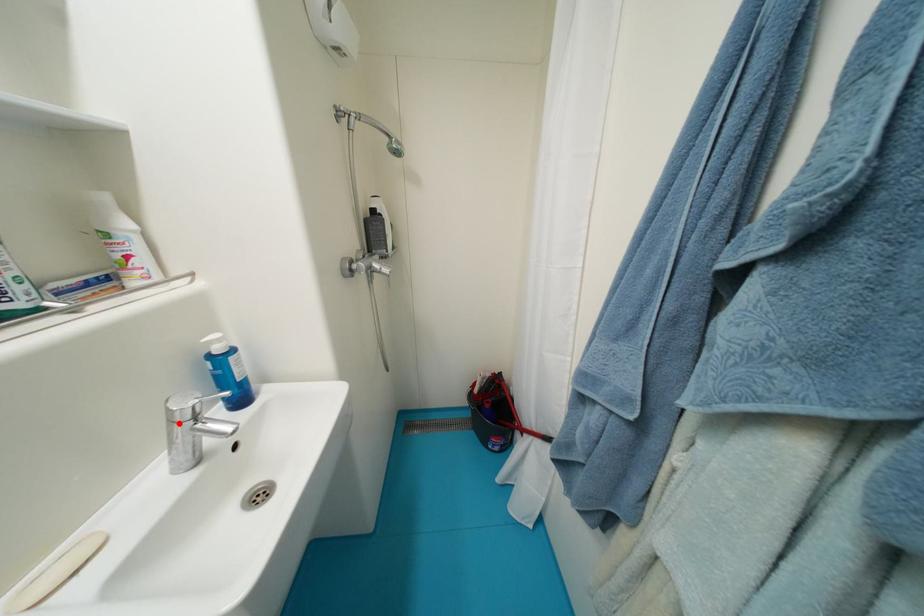
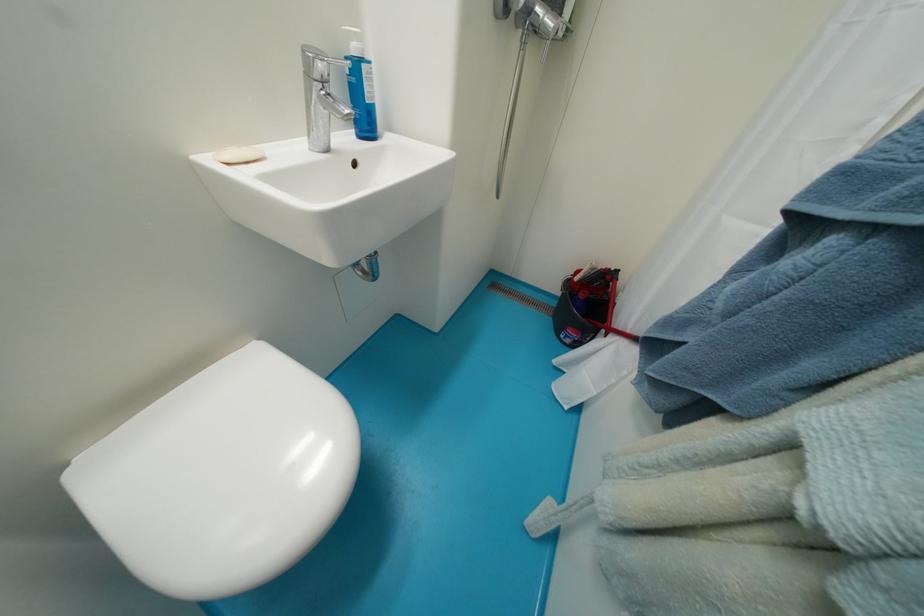
In the second image, find the point that corresponds to the highlighted location in the first image.

(313, 78)